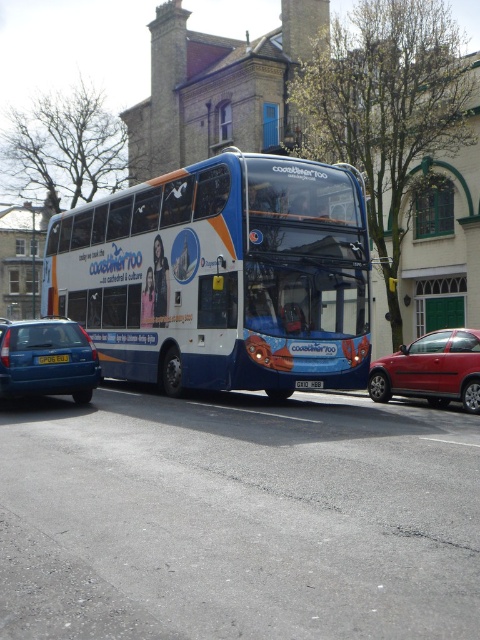
You are a delivery person trying to park your van, which is 12 feet long, between the blue metallic bus at center and the metallic blue sedan at left. Is there enough space between them to fit your van?

The distance between the blue metallic bus at center and the metallic blue sedan at left is 8.66 feet, which is shorter than your van length of 12 feet. Therefore, there is not enough space to park your van between them.

You are a photographer trying to capture both the blue metallic bus at center and the metallic red sedan at right in a single frame. Which vehicle should you position closer to the camera to ensure both are fully visible?

Since the blue metallic bus at center is larger in size than the metallic red sedan at right, you should position the metallic red sedan at right closer to the camera to balance their sizes in the frame.

You are a delivery person who needs to park your 2.5 meter wide van between the metallic red sedan at right and the yellow plastic license plate at center. Is there enough space?

The metallic red sedan at right might be wider than yellow plastic license plate at center, so there may not be enough space for your van.